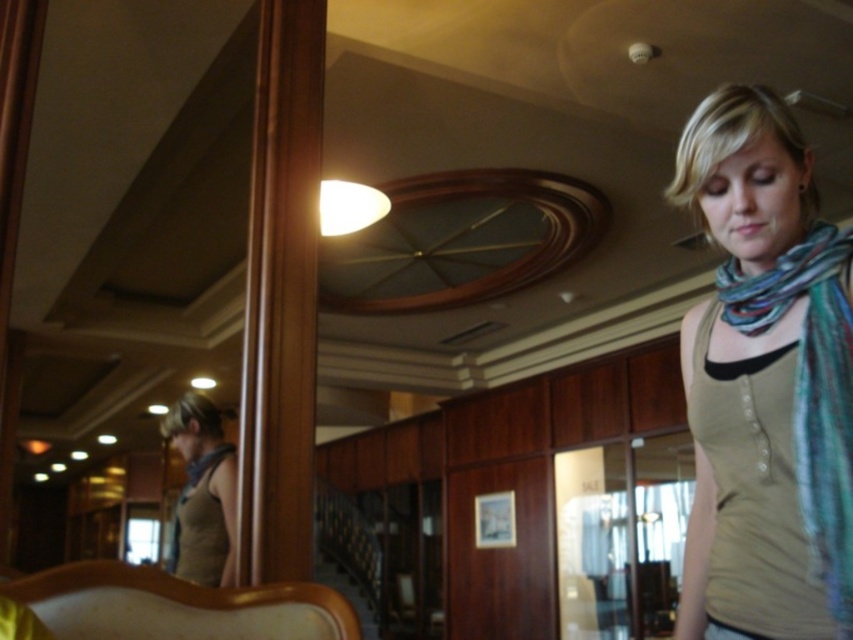
You are a photographer adjusting your camera settings to capture the reflection in the mirror. You notice the multicolored woven scarf at right and the matte brown scarf at left in the scene. Which scarf will appear larger in the reflection?

The multicolored woven scarf at right will appear larger in the reflection because it is closer to the viewer than the matte brown scarf at left, so its reflection would be magnified compared to the one further away.

Looking at this image, you are standing in the lobby and want to reach the point marked at coordinates [838,492]. If your arm is 36 inches long, can you touch that point without moving your feet?

The point marked at coordinates [838,492] is 37.35 inches away from you. Since your arm is only 36 inches long, you cannot reach it without moving your feet.